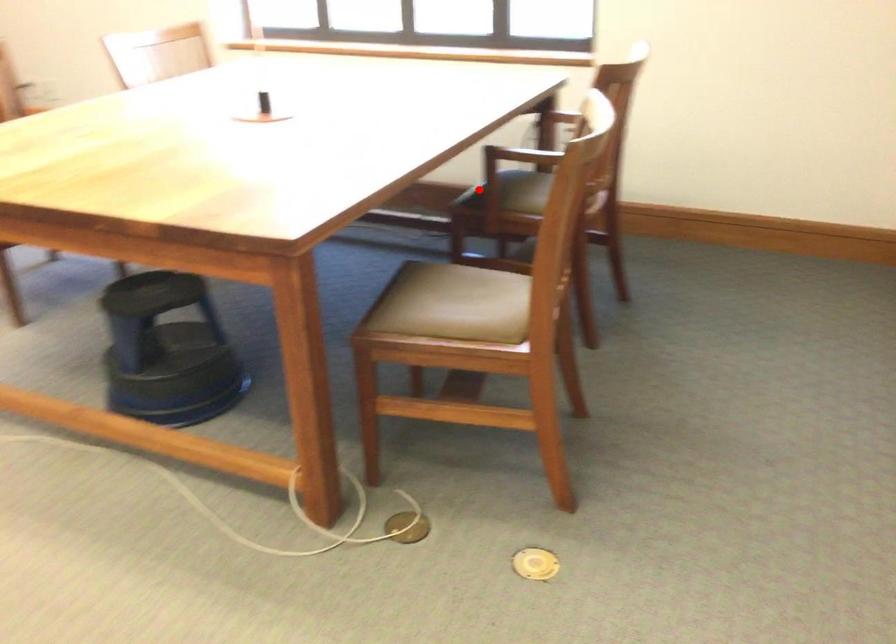
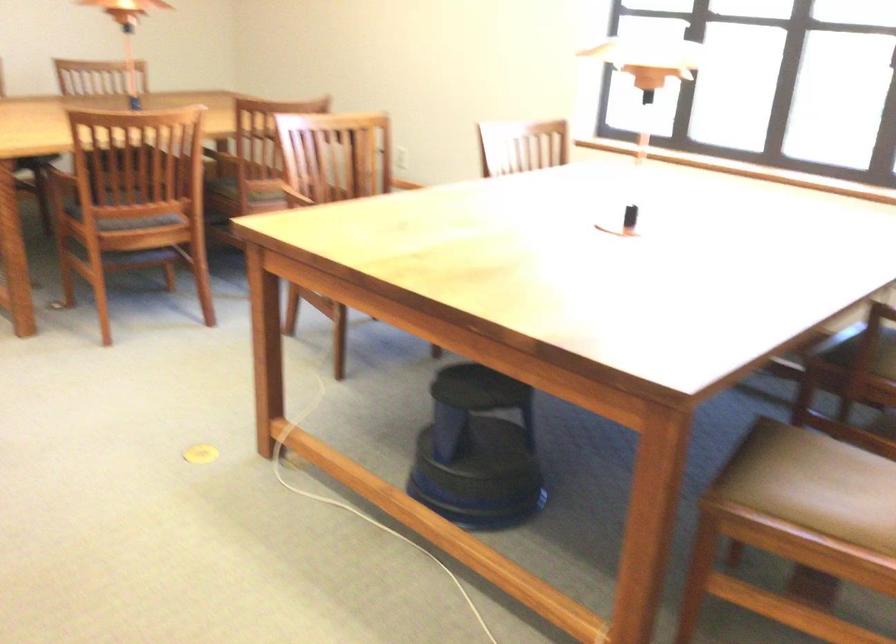
Question: I am providing you with two images of the same scene from different viewpoints. Image1 has a red point marked. In image2, the corresponding 3D location appears at what relative position? Reply with the corresponding letter.

Choices:
 (A) Closer
 (B) Farther

Answer: (A)